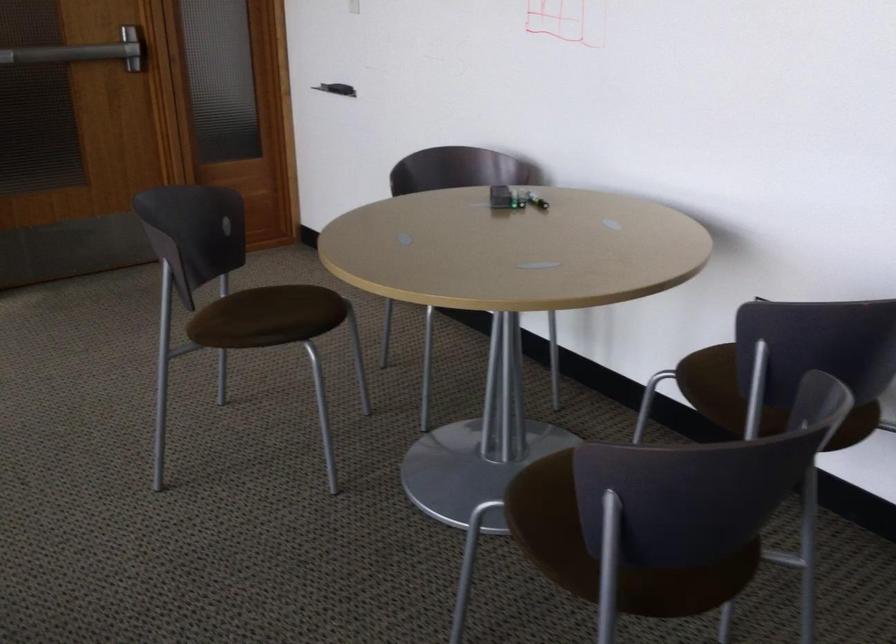
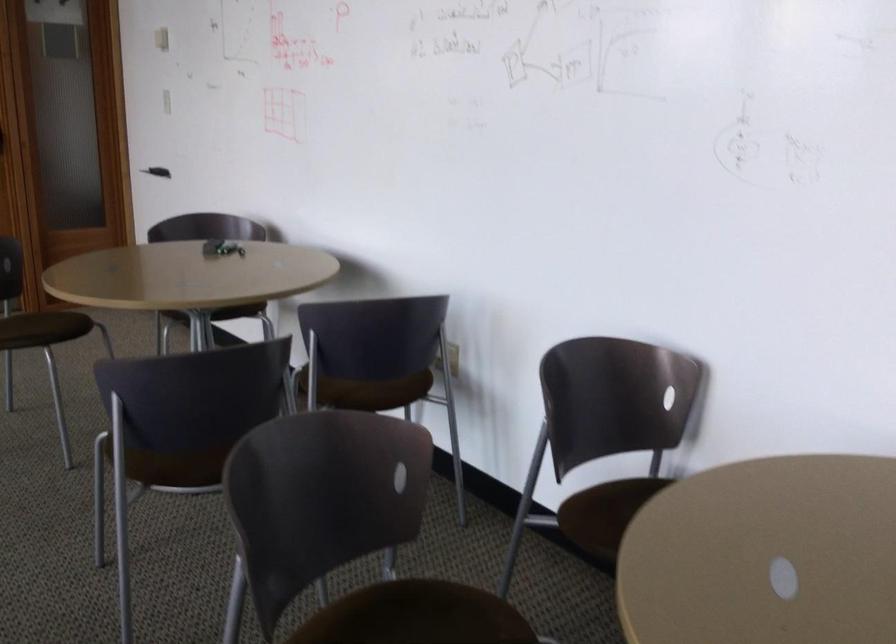
In the second image, find the point that corresponds to (291,330) in the first image.

(44, 328)